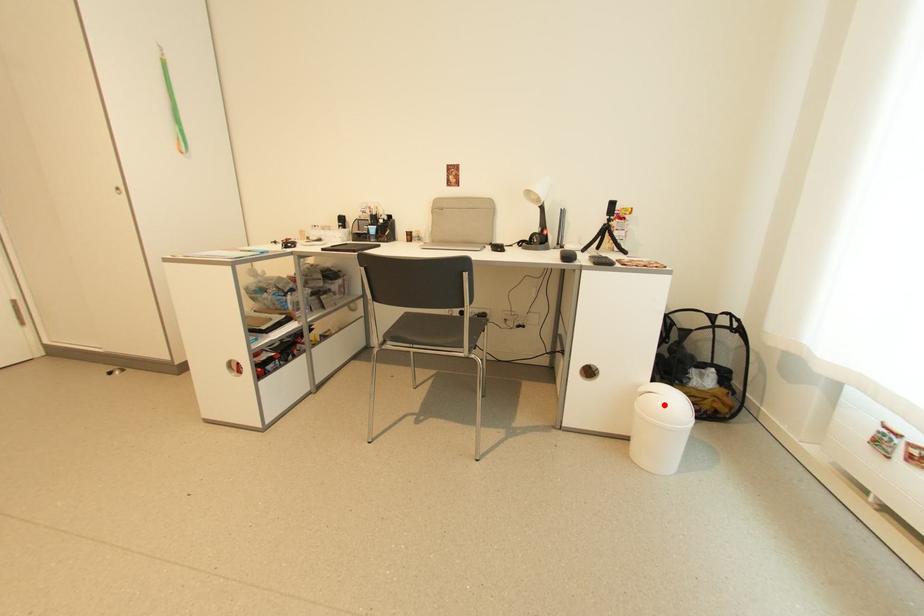
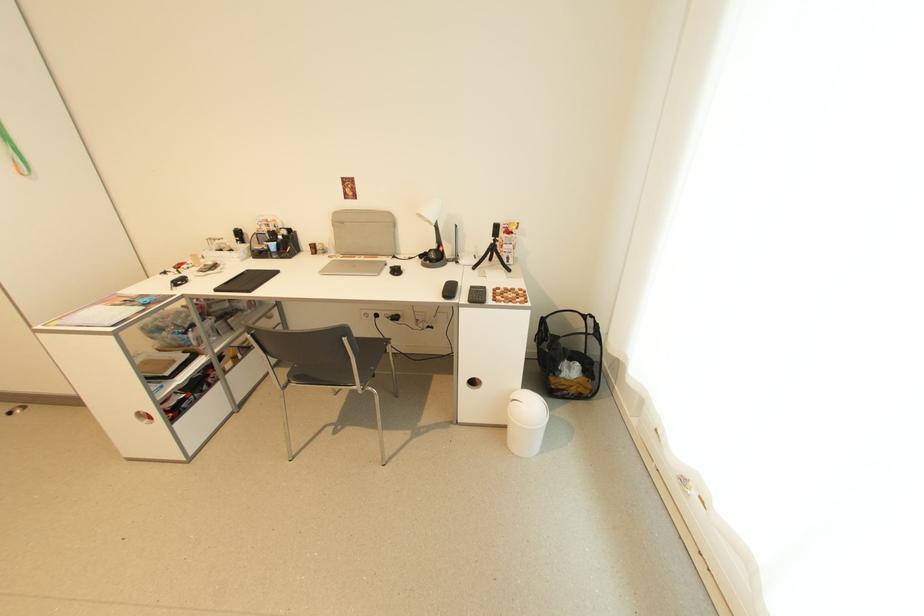
Locate, in the second image, the point that corresponds to the highlighted location in the first image.

(529, 410)